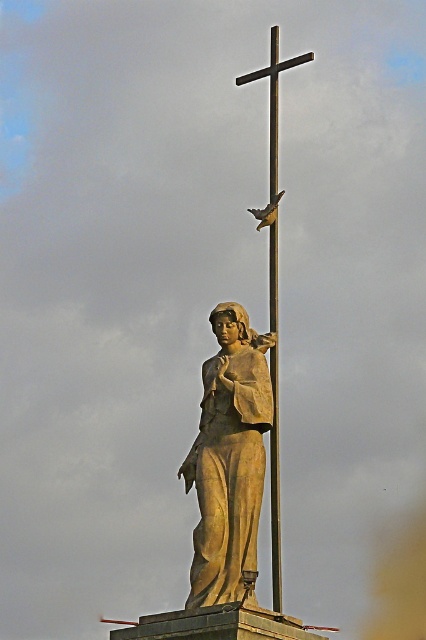
Does matte bronze statue at center have a larger size compared to matte gray bird at center?

Yes, matte bronze statue at center is bigger than matte gray bird at center.

What do you see at coordinates (229, 458) in the screenshot? I see `matte bronze statue at center` at bounding box center [229, 458].

Describe the element at coordinates (229, 458) in the screenshot. I see `matte bronze statue at center` at that location.

At what (x,y) coordinates should I click in order to perform the action: click on matte bronze statue at center. Please return your answer as a coordinate pair (x, y). This screenshot has width=426, height=640. Looking at the image, I should click on (229, 458).